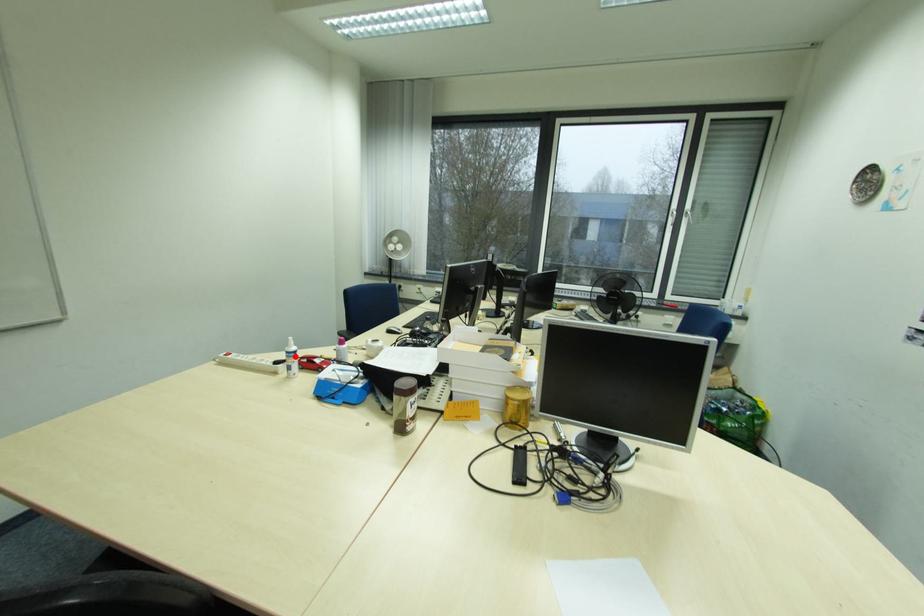
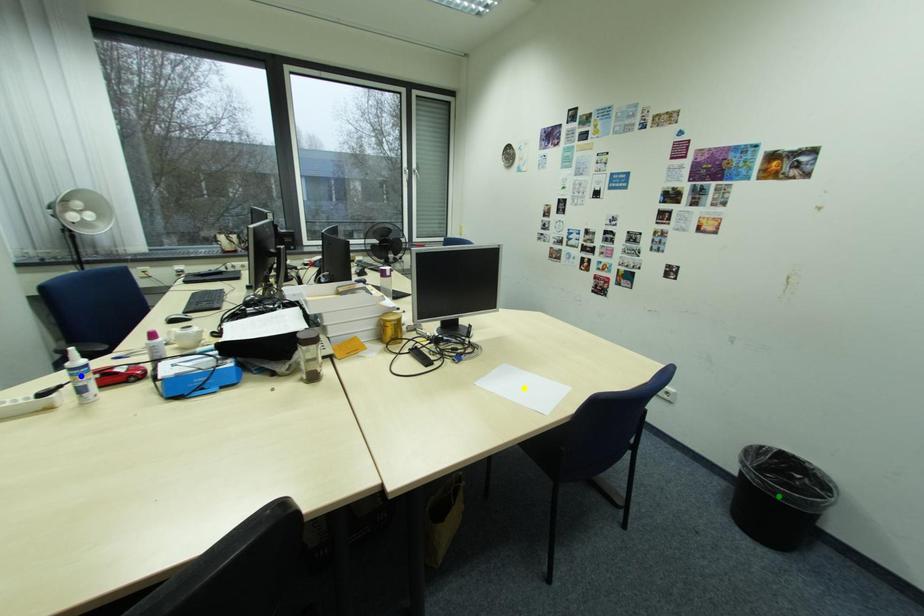
Question: I am providing you with two images of the same scene from different viewpoints. A red point is marked on the first image. You are given multiple points on the second image. Which mark in image 2 goes with the point in image 1?

Choices:
 (A) green point
 (B) blue point
 (C) yellow point

Answer: (B)